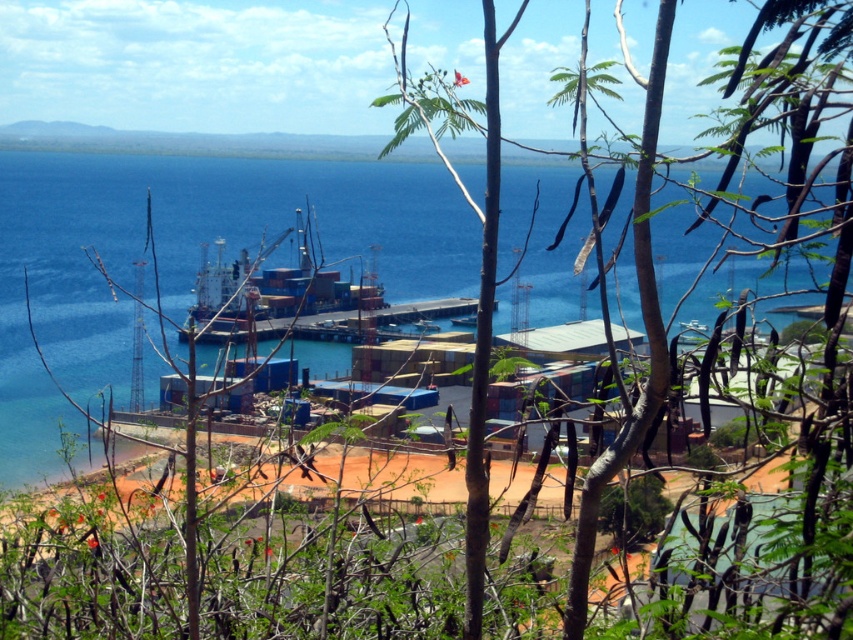
You are an observer looking at the coastal industrial area scene. You notice the green leafy branches at center and the blue water at center. Which object appears shorter in the image?

The green leafy branches at center appears shorter than the blue water at center.

You are standing in the coastal industrial area and looking at the scene. Which object is closer to you between the green leafy branches at center and the blue water at center?

The green leafy branches at center are closer to you since they are in front of the blue water at center.